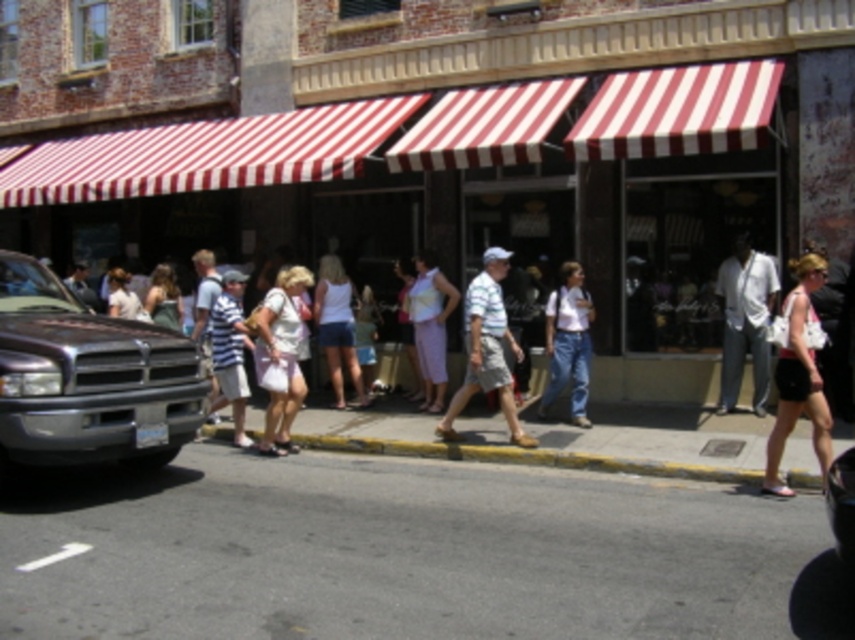
Is point (655, 465) positioned behind point (821, 390)?

Yes, point (655, 465) is farther from viewer.

Does yellow painted curb at lower center appear over white fabric shorts at right?

Actually, yellow painted curb at lower center is below white fabric shorts at right.

Identify the location of yellow painted curb at lower center. The height and width of the screenshot is (640, 855). (528, 458).

Is striped cotton shirt at center behind shiny black car at center?

Yes, it is behind shiny black car at center.

Is point (476, 292) positioned after point (847, 520)?

Yes, it is.

Is point (469, 284) farther from viewer compared to point (836, 529)?

Yes, point (469, 284) is behind point (836, 529).

This screenshot has height=640, width=855. In order to click on striped cotton shirt at center in this screenshot , I will do `click(486, 348)`.

Who is higher up, white fabric shorts at right or striped fabric shorts at center?

striped fabric shorts at center is higher up.

Who is positioned more to the left, white fabric shorts at right or striped fabric shorts at center?

striped fabric shorts at center is more to the left.

Identify the location of white fabric shorts at right. (799, 376).

You are a GUI agent. You are given a task and a screenshot of the screen. Output one action in this format:
    pyautogui.click(x=<x>, y=<y>)
    Task: Click on the white fabric shorts at right
    The image size is (855, 640).
    Given the screenshot: What is the action you would take?
    pyautogui.click(x=799, y=376)